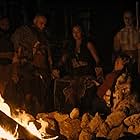
The image size is (140, 140). What are the coordinates of `empty space at top right corner` in the screenshot? It's located at (x=138, y=1).